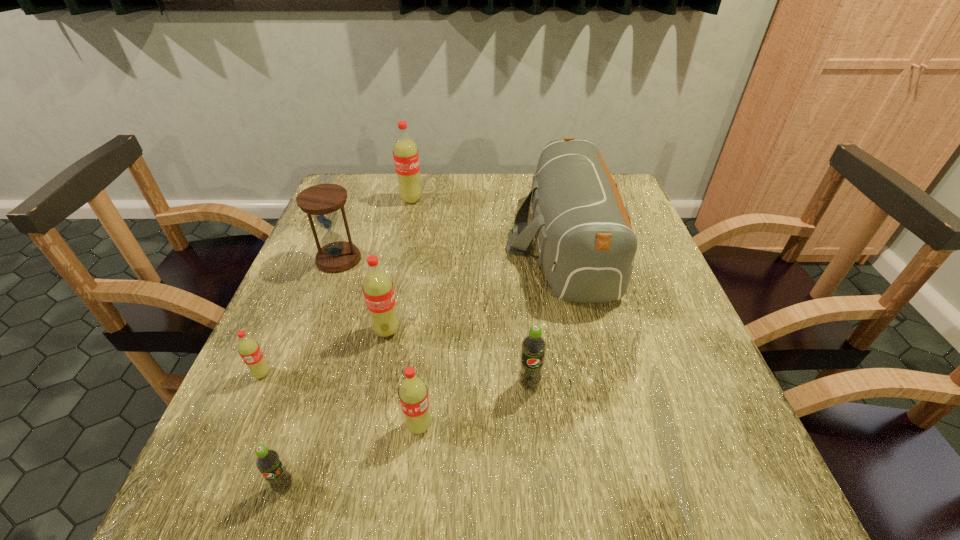
In order to click on free space located on the front of the smallest red soda in this screenshot , I will do [x=227, y=454].

Locate an element on the screen. The height and width of the screenshot is (540, 960). soda located in the far edge section of the desktop is located at coordinates (405, 152).

This screenshot has height=540, width=960. In order to click on duffel bag positioned at the far edge in this screenshot , I will do click(586, 244).

Where is `object at the near edge`? This screenshot has height=540, width=960. object at the near edge is located at coordinates (268, 462).

Locate an element on the screen. The height and width of the screenshot is (540, 960). hourglass that is at the left edge is located at coordinates (322, 201).

The height and width of the screenshot is (540, 960). I want to click on object that is at the right edge, so click(586, 244).

Where is `object located at the near left corner`? object located at the near left corner is located at coordinates (268, 462).

The image size is (960, 540). Identify the location of object that is at the far right corner. (586, 244).

In the image, there is a desktop. What are the coordinates of `vacant space at the near edge` in the screenshot? It's located at (363, 506).

Find the location of `free space at the left edge of the desktop`. free space at the left edge of the desktop is located at coordinates (318, 288).